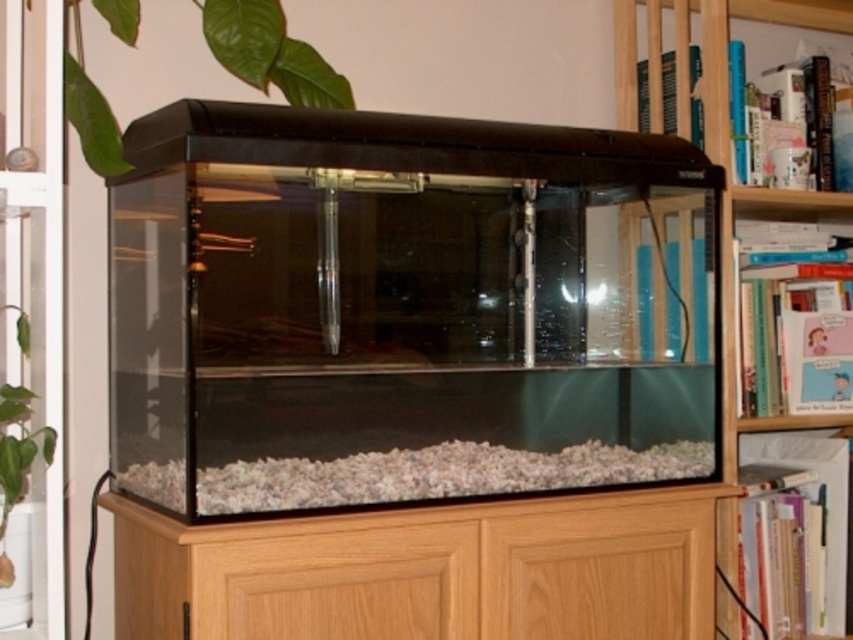
You are standing in front of the aquarium and notice two points marked in the image. The first point is at coordinates point (x=467, y=445) and the second is at point (x=705, y=44). Which point is closer to your current position?

Point (x=467, y=445) is closer to the camera than point (x=705, y=44), so the first point is closer to your current position.

You are setting up a new aquarium in your home. You have a bag of white gravel and need to place it correctly. Based on the scene, where should you position the white gravel at bottom in relation to the wooden bookshelf at upper right?

The white gravel at bottom should be placed to the left of the wooden bookshelf at upper right as per the scene description.